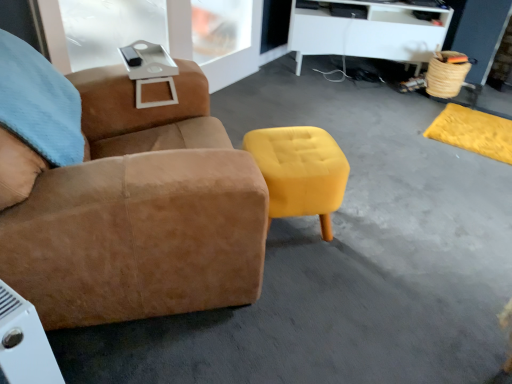
This screenshot has height=384, width=512. I want to click on vacant point to the right of yellow suede ottoman at center, so click(x=372, y=246).